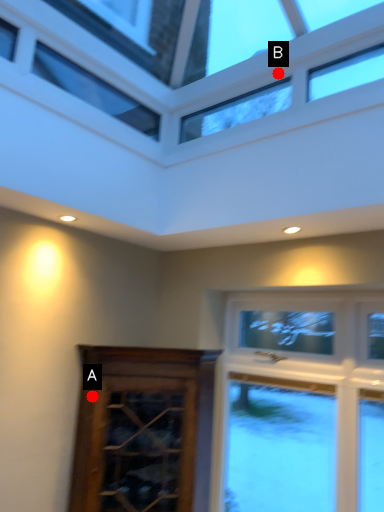
Question: Two points are circled on the image, labeled by A and B beside each circle. Which point is closer to the camera?

Choices:
 (A) A is closer
 (B) B is closer

Answer: (B)